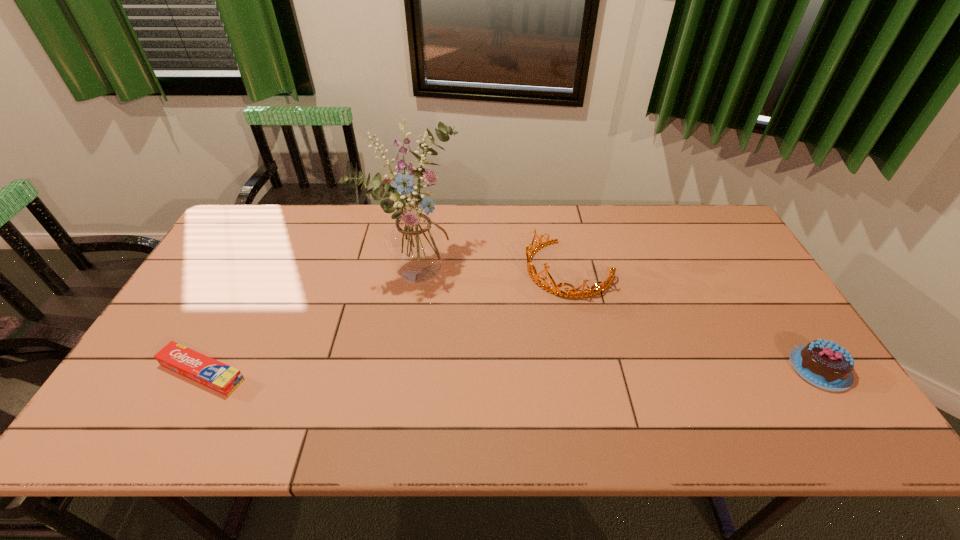
You are a GUI agent. You are given a task and a screenshot of the screen. Output one action in this format:
    pyautogui.click(x=<x>, y=<y>)
    Task: Click on the object located in the left edge section of the desktop
    Image resolution: width=960 pixels, height=540 pixels.
    Given the screenshot: What is the action you would take?
    pyautogui.click(x=198, y=367)

Where is `object that is at the right edge`? object that is at the right edge is located at coordinates (824, 364).

Find the location of `object that is at the near left corner`. object that is at the near left corner is located at coordinates (198, 367).

You are a GUI agent. You are given a task and a screenshot of the screen. Output one action in this format:
    pyautogui.click(x=<x>, y=<y>)
    Task: Click on the object that is at the near right corner
    The image size is (960, 540).
    Given the screenshot: What is the action you would take?
    pyautogui.click(x=824, y=364)

This screenshot has width=960, height=540. In the image, there is a desktop. What are the coordinates of `vacant space at the far edge` in the screenshot? It's located at (339, 236).

This screenshot has width=960, height=540. I want to click on free space at the near edge of the desktop, so click(x=502, y=397).

Locate an element on the screen. This screenshot has height=540, width=960. free point at the left edge is located at coordinates (154, 362).

In order to click on vacant space at the right edge of the desktop in this screenshot , I will do `click(725, 274)`.

The width and height of the screenshot is (960, 540). In the image, there is a desktop. In order to click on free space at the far left corner in this screenshot , I will do `click(231, 245)`.

In the image, there is a desktop. Identify the location of vacant space at the far right corner. The height and width of the screenshot is (540, 960). (674, 216).